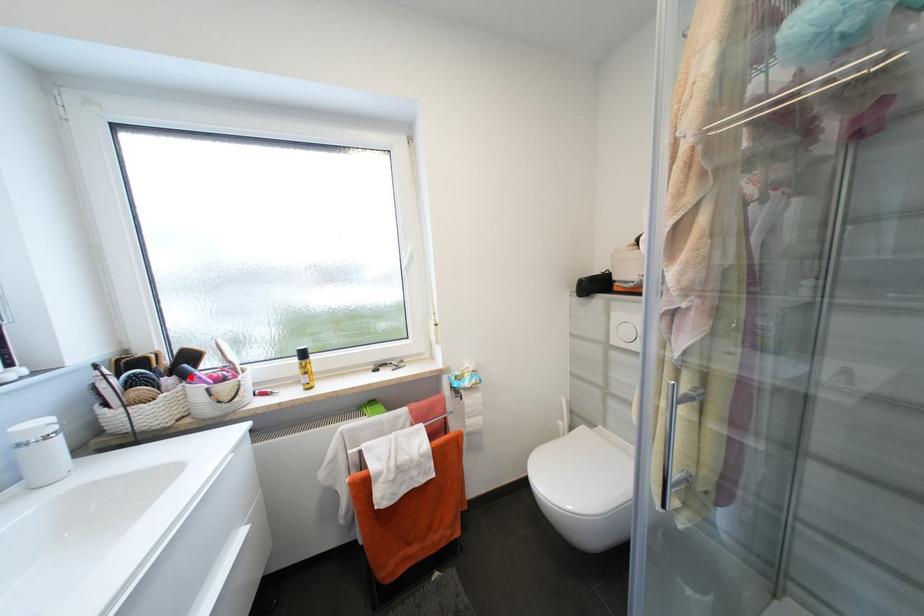
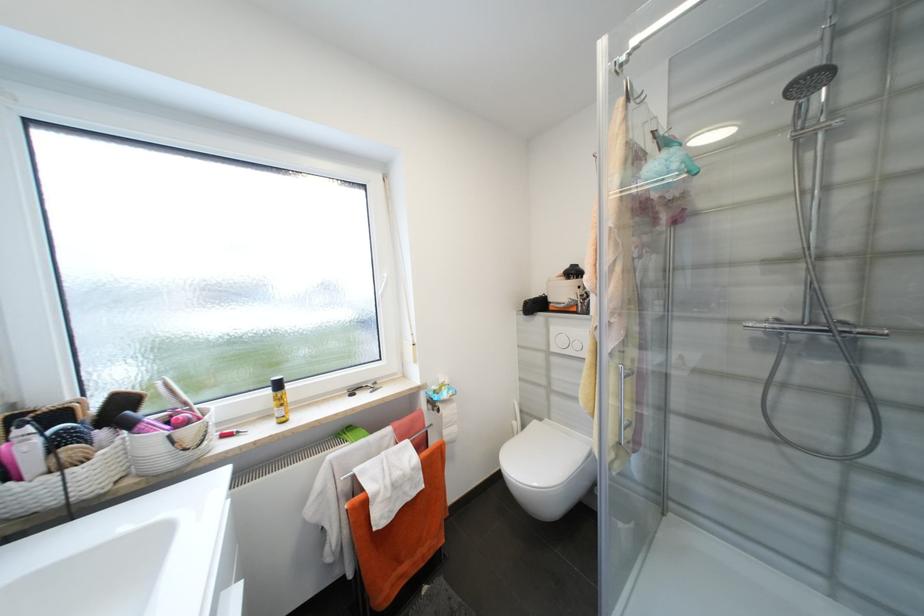
The point at the highlighted location is marked in the first image. Where is the corresponding point in the second image?

(134, 427)